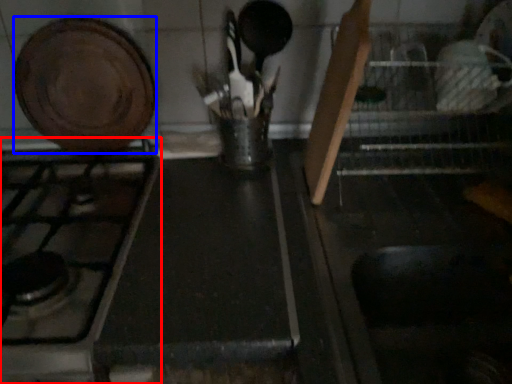
Question: Which point is further to the camera, gas stove (highlighted by a red box) or kitchen appliance (highlighted by a blue box)?

Choices:
 (A) gas stove
 (B) kitchen appliance

Answer: (B)